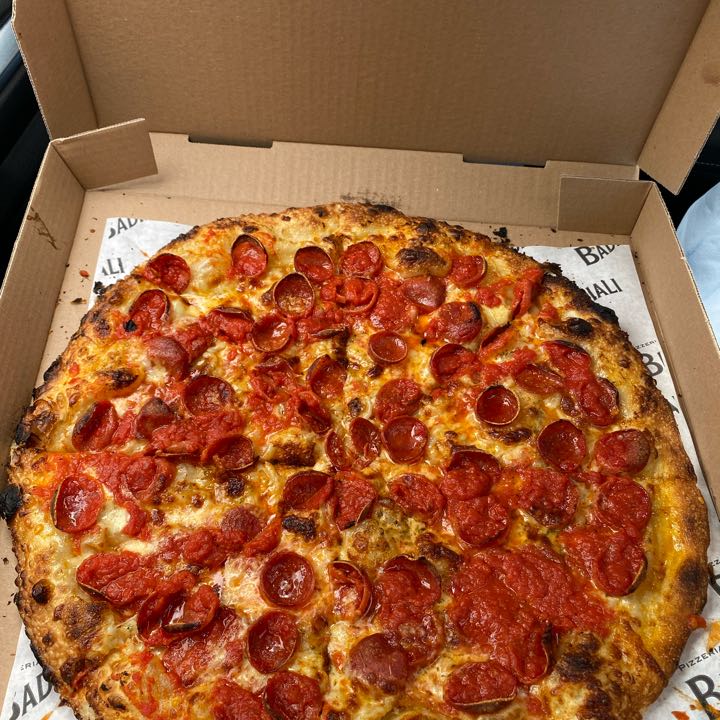
I want to click on cardboard box, so click(x=508, y=121).